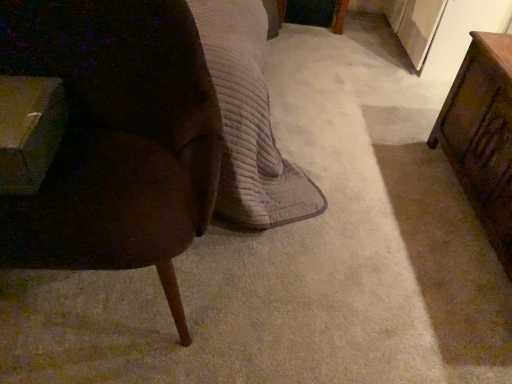
Describe the element at coordinates (29, 130) in the screenshot. I see `wooden table at left, arranged as the second table when viewed from the right` at that location.

You are a GUI agent. You are given a task and a screenshot of the screen. Output one action in this format:
    pyautogui.click(x=<x>, y=<y>)
    Task: Click on the velvet brown chair at left
    The image size is (512, 384).
    Given the screenshot: What is the action you would take?
    pyautogui.click(x=116, y=138)

Measure the distance between wooden table at right, the second table viewed from the left, and camera.

wooden table at right, the second table viewed from the left, is 1.42 meters away from camera.

Image resolution: width=512 pixels, height=384 pixels. Identify the location of wooden table at left, arranged as the 1th table when viewed from the left. (29, 130).

Considering the sizes of wooden table at right, which is the first table in right-to-left order, and wooden table at left, arranged as the 1th table when viewed from the left, in the image, is wooden table at right, which is the first table in right-to-left order, wider or thinner than wooden table at left, arranged as the 1th table when viewed from the left,?

wooden table at right, which is the first table in right-to-left order, is wider than wooden table at left, arranged as the 1th table when viewed from the left.

Locate an element on the screen. This screenshot has width=512, height=384. table above the wooden table at right, which is the first table in right-to-left order (from a real-world perspective) is located at coordinates (29, 130).

From a real-world perspective, is wooden table at right, the second table viewed from the left, positioned under wooden table at left, arranged as the second table when viewed from the right, based on gravity?

Yes, from a real-world perspective, wooden table at right, the second table viewed from the left, is beneath wooden table at left, arranged as the second table when viewed from the right.

Who is bigger, wooden table at right, which is the first table in right-to-left order, or wooden table at left, arranged as the 1th table when viewed from the left?

Bigger between the two is wooden table at right, which is the first table in right-to-left order.

Identify the location of chair that is on the right side of wooden table at left, arranged as the 1th table when viewed from the left. Image resolution: width=512 pixels, height=384 pixels. (116, 138).

Which is more to the right, wooden table at left, arranged as the 1th table when viewed from the left, or velvet brown chair at left?

Positioned to the right is velvet brown chair at left.

Which of these two, wooden table at left, arranged as the second table when viewed from the right, or velvet brown chair at left, stands taller?

Standing taller between the two is velvet brown chair at left.

Can you tell me how much wooden table at left, arranged as the second table when viewed from the right, and velvet brown chair at left differ in facing direction?

0.000124 degrees.

Measure the distance from velvet brown chair at left to wooden table at left, arranged as the second table when viewed from the right.

The distance of velvet brown chair at left from wooden table at left, arranged as the second table when viewed from the right, is 17.60 centimeters.

Can you see velvet brown chair at left touching wooden table at left, arranged as the second table when viewed from the right?

No.

Which is behind, velvet brown chair at left or wooden table at left, arranged as the 1th table when viewed from the left?

wooden table at left, arranged as the 1th table when viewed from the left, is further from the camera.

From the picture: Is velvet brown chair at left looking in the opposite direction of wooden table at right, the second table viewed from the left?

No.

Which is closer, (116,137) or (505,252)?

Point (116,137) is positioned closer to the camera compared to point (505,252).

Looking at this image, from the image's perspective, which object appears higher, velvet brown chair at left or wooden table at right, the second table viewed from the left?

From the image's view, wooden table at right, the second table viewed from the left, is above.

Which of these two, velvet brown chair at left or wooden table at right, the second table viewed from the left, stands shorter?

wooden table at right, the second table viewed from the left, is shorter.

From the image's perspective, is wooden table at left, arranged as the 1th table when viewed from the left, located above wooden table at right, which is the first table in right-to-left order?

Indeed, from the image's perspective, wooden table at left, arranged as the 1th table when viewed from the left, is shown above wooden table at right, which is the first table in right-to-left order.

Is the depth of wooden table at left, arranged as the 1th table when viewed from the left, less than that of wooden table at right, the second table viewed from the left?

That is True.

Are wooden table at left, arranged as the 1th table when viewed from the left, and wooden table at right, the second table viewed from the left, located far from each other?

wooden table at left, arranged as the 1th table when viewed from the left, is far away from wooden table at right, the second table viewed from the left.

Is wooden table at right, the second table viewed from the left, facing towards velvet brown chair at left?

Yes, wooden table at right, the second table viewed from the left, is turned towards velvet brown chair at left.

Are wooden table at right, which is the first table in right-to-left order, and velvet brown chair at left beside each other?

wooden table at right, which is the first table in right-to-left order, is not next to velvet brown chair at left, and they're not touching.

Which is less distant, (483, 80) or (126, 156)?

Point (483, 80).

In the image, is wooden table at right, the second table viewed from the left, on the left side or the right side of velvet brown chair at left?

Based on their positions, wooden table at right, the second table viewed from the left, is located to the right of velvet brown chair at left.

Locate an element on the screen. This screenshot has height=384, width=512. table beneath the wooden table at left, arranged as the second table when viewed from the right (from a real-world perspective) is located at coordinates (482, 136).

The height and width of the screenshot is (384, 512). Find the location of `table that appears above the velvet brown chair at left (from a real-world perspective)`. table that appears above the velvet brown chair at left (from a real-world perspective) is located at coordinates 29,130.

Considering their positions, is wooden table at right, the second table viewed from the left, positioned closer to wooden table at left, arranged as the 1th table when viewed from the left, than velvet brown chair at left?

Among the two, velvet brown chair at left is located nearer to wooden table at left, arranged as the 1th table when viewed from the left.

When comparing their distances from velvet brown chair at left, does wooden table at left, arranged as the 1th table when viewed from the left, or wooden table at right, the second table viewed from the left, seem closer?

wooden table at left, arranged as the 1th table when viewed from the left, is closer to velvet brown chair at left.

Considering their positions, is wooden table at left, arranged as the second table when viewed from the right, positioned further to wooden table at right, the second table viewed from the left, than velvet brown chair at left?

Among the two, wooden table at left, arranged as the second table when viewed from the right, is located further to wooden table at right, the second table viewed from the left.

Based on their spatial positions, is velvet brown chair at left or wooden table at left, arranged as the second table when viewed from the right, further from wooden table at right, the second table viewed from the left?

The object further to wooden table at right, the second table viewed from the left, is wooden table at left, arranged as the second table when viewed from the right.

Looking at the image, which one is located closer to velvet brown chair at left, wooden table at right, which is the first table in right-to-left order, or wooden table at left, arranged as the 1th table when viewed from the left?

wooden table at left, arranged as the 1th table when viewed from the left, is closer to velvet brown chair at left.

Looking at the image, which one is located further to wooden table at left, arranged as the 1th table when viewed from the left, velvet brown chair at left or wooden table at right, which is the first table in right-to-left order?

Among the two, wooden table at right, which is the first table in right-to-left order, is located further to wooden table at left, arranged as the 1th table when viewed from the left.

Locate an element on the screen. chair located between wooden table at left, arranged as the 1th table when viewed from the left, and wooden table at right, which is the first table in right-to-left order, in the left-right direction is located at coordinates (116, 138).